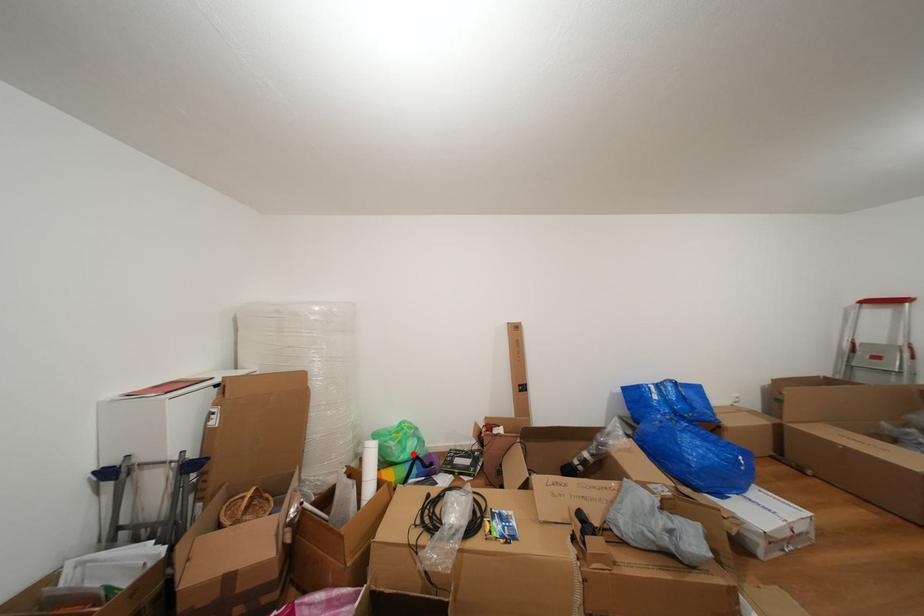
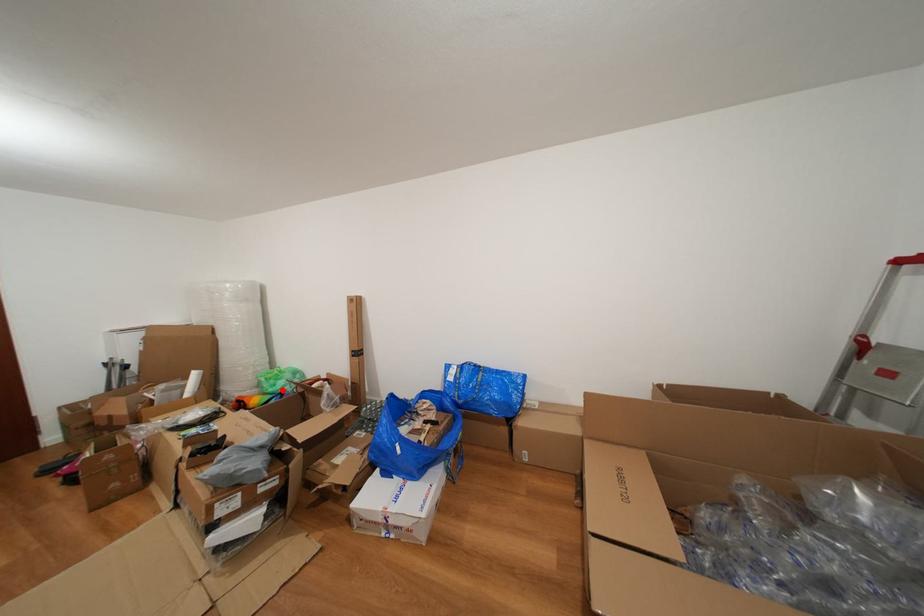
I am providing you with two images of the same scene from different viewpoints. A red point is marked on the first image and another point is marked on the second image. Are the points marked in image1 and image2 representing the same 3D position?

Yes